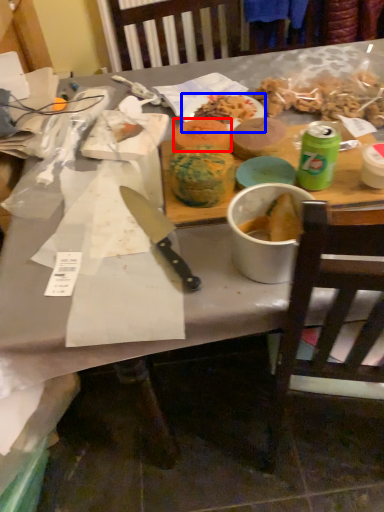
Question: Which point is further to the camera, food (highlighted by a red box) or plate (highlighted by a blue box)?

Choices:
 (A) food
 (B) plate

Answer: (B)